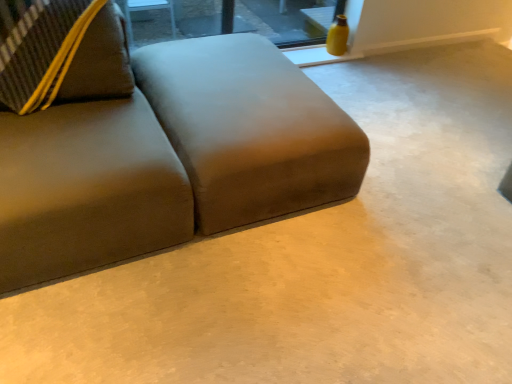
Question: Based on their sizes in the image, would you say suede-like brown couch at left is bigger or smaller than transparent glass window at upper center?

Choices:
 (A) small
 (B) big

Answer: (B)

Question: Is suede-like brown couch at left wider or thinner than transparent glass window at upper center?

Choices:
 (A) thin
 (B) wide

Answer: (B)

Question: Is suede-like brown couch at left taller or shorter than transparent glass window at upper center?

Choices:
 (A) short
 (B) tall

Answer: (B)

Question: Do you think transparent glass window at upper center is within suede-like brown couch at left, or outside of it?

Choices:
 (A) inside
 (B) outside

Answer: (B)

Question: Looking at their shapes, would you say transparent glass window at upper center is wider or thinner than suede-like brown couch at left?

Choices:
 (A) thin
 (B) wide

Answer: (A)

Question: Based on their sizes in the image, would you say transparent glass window at upper center is bigger or smaller than suede-like brown couch at left?

Choices:
 (A) big
 (B) small

Answer: (B)

Question: Is point (237, 16) closer or farther from the camera than point (89, 79)?

Choices:
 (A) closer
 (B) farther

Answer: (B)